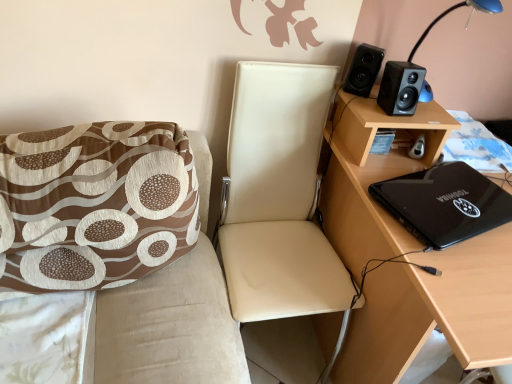
Question: Does blue floral fabric at lower right have a larger size compared to black matte speaker at upper right, the 1th speaker in the left-to-right sequence?

Choices:
 (A) yes
 (B) no

Answer: (A)

Question: From a real-world perspective, is blue floral fabric at lower right located higher than black matte speaker at upper right, the 1th speaker in the left-to-right sequence?

Choices:
 (A) no
 (B) yes

Answer: (A)

Question: Is blue floral fabric at lower right oriented away from black matte speaker at upper right, the 1th speaker in the left-to-right sequence?

Choices:
 (A) yes
 (B) no

Answer: (B)

Question: Can you confirm if blue floral fabric at lower right is thinner than black matte speaker at upper right, the 1th speaker in the left-to-right sequence?

Choices:
 (A) no
 (B) yes

Answer: (A)

Question: Can you confirm if blue floral fabric at lower right is shorter than black matte speaker at upper right, the second speaker positioned from the right?

Choices:
 (A) no
 (B) yes

Answer: (B)

Question: Is blue floral fabric at lower right beside black matte speaker at upper right, the second speaker positioned from the right?

Choices:
 (A) yes
 (B) no

Answer: (B)

Question: Does leather-like beige chair at center, the 2th chair positioned from the left, have a greater width compared to black plastic table lamp at upper right?

Choices:
 (A) no
 (B) yes

Answer: (B)

Question: Is leather-like beige chair at center, the 2th chair positioned from the left, facing away from black plastic table lamp at upper right?

Choices:
 (A) yes
 (B) no

Answer: (B)

Question: Would you consider leather-like beige chair at center, the 1th chair from the right, to be distant from black plastic table lamp at upper right?

Choices:
 (A) yes
 (B) no

Answer: (B)

Question: Is leather-like beige chair at center, the 2th chair positioned from the left, outside black plastic table lamp at upper right?

Choices:
 (A) yes
 (B) no

Answer: (A)

Question: From a real-world perspective, is leather-like beige chair at center, the 2th chair positioned from the left, positioned over black plastic table lamp at upper right based on gravity?

Choices:
 (A) yes
 (B) no

Answer: (B)

Question: Considering the relative positions of leather-like beige chair at center, the 2th chair positioned from the left, and black plastic table lamp at upper right in the image provided, is leather-like beige chair at center, the 2th chair positioned from the left, to the left of black plastic table lamp at upper right from the viewer's perspective?

Choices:
 (A) no
 (B) yes

Answer: (B)

Question: Considering the relative sizes of brown printed fabric cushion at left, acting as the first chair starting from the left, and black matte speaker at upper right, the 1th speaker in the left-to-right sequence, in the image provided, is brown printed fabric cushion at left, acting as the first chair starting from the left, thinner than black matte speaker at upper right, the 1th speaker in the left-to-right sequence,?

Choices:
 (A) no
 (B) yes

Answer: (A)